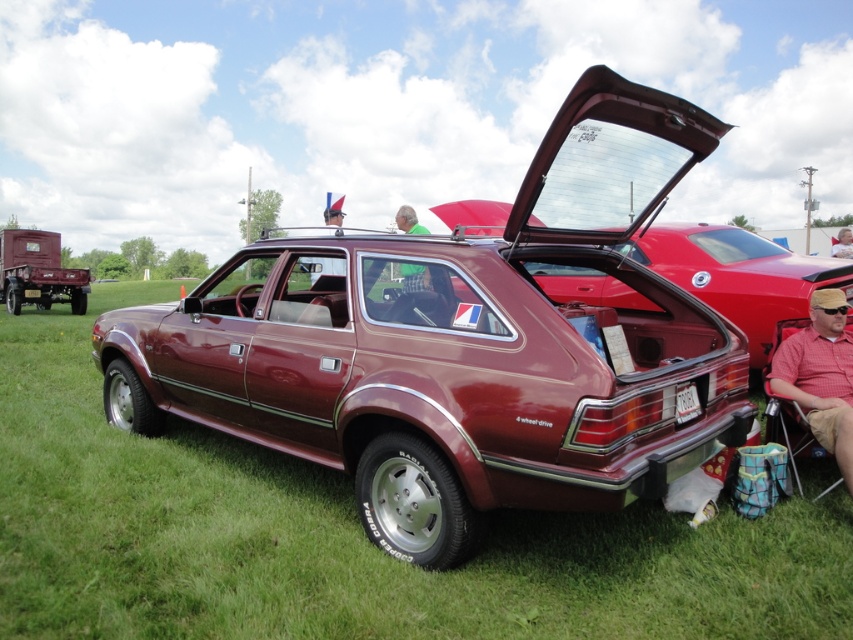
Question: Which of the following is the farthest from the observer?

Choices:
 (A) (416, 224)
 (B) (90, 365)
 (C) (796, 371)

Answer: (B)

Question: Which point is closer to the camera?

Choices:
 (A) red plaid shirt at lower right
 (B) green plaid shirt at center
 (C) maroon metallic car at center
 (D) maroon matte hatchback at center

Answer: (C)

Question: Can you confirm if maroon matte hatchback at center is positioned to the left of red plaid shirt at lower right?

Choices:
 (A) no
 (B) yes

Answer: (A)

Question: Is maroon metallic car at center closer to camera compared to green plaid shirt at center?

Choices:
 (A) no
 (B) yes

Answer: (B)

Question: Which object is positioned farthest from the maroon metallic car at center?

Choices:
 (A) maroon matte hatchback at center
 (B) maroon metallic hatchback at center
 (C) green plaid shirt at center
 (D) red plaid shirt at lower right

Answer: (C)

Question: Can you confirm if red plaid shirt at lower right is positioned to the right of green plaid shirt at center?

Choices:
 (A) no
 (B) yes

Answer: (B)